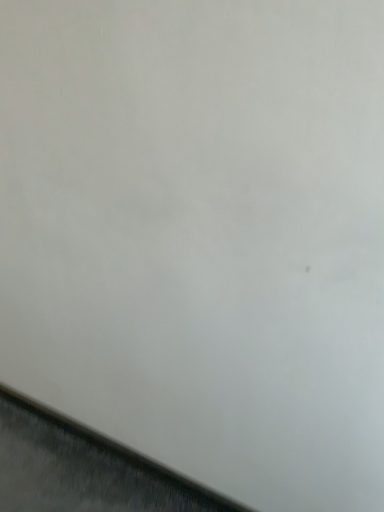
Where is `empty space that is ontop of dark gray carpet at lower left (from a real-world perspective)`? The image size is (384, 512). empty space that is ontop of dark gray carpet at lower left (from a real-world perspective) is located at coordinates (119, 431).